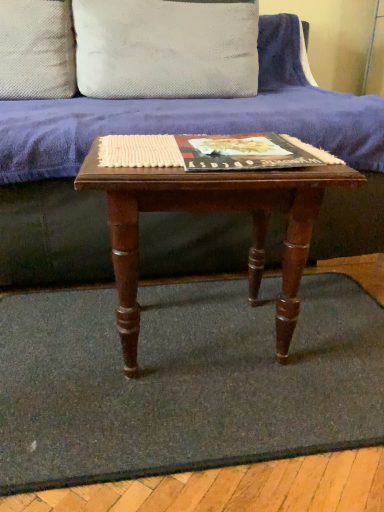
Locate an element on the screen. empty space that is ontop of gray carpet at center (from a real-world perspective) is located at coordinates (202, 356).